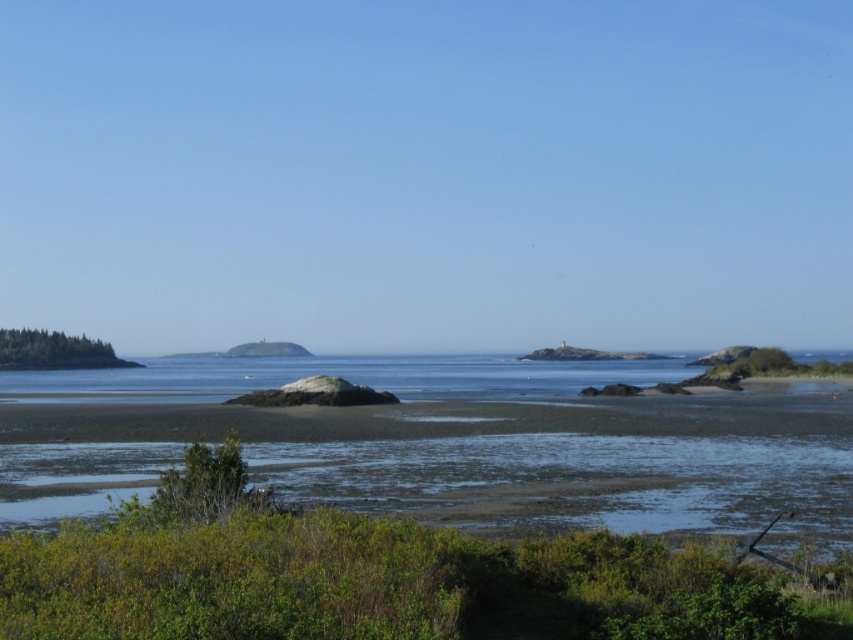
Is green grassy beach at lower center closer to the viewer compared to green grassy island at left?

Yes, it is in front of green grassy island at left.

Between point (370, 432) and point (42, 344), which one is positioned behind?

The point (42, 344) is behind.

Locate an element on the screen. green grassy beach at lower center is located at coordinates (x=457, y=452).

Is green grassy beach at lower center taller than clear blue water at center?

Yes, green grassy beach at lower center is taller than clear blue water at center.

This screenshot has height=640, width=853. What do you see at coordinates (457, 452) in the screenshot?
I see `green grassy beach at lower center` at bounding box center [457, 452].

Identify the location of green grassy beach at lower center. (457, 452).

Find the location of a particular element. The width and height of the screenshot is (853, 640). clear blue water at center is located at coordinates (347, 376).

Which is above, clear blue water at center or green grassy island at left?

green grassy island at left is above.

Locate an element on the screen. Image resolution: width=853 pixels, height=640 pixels. clear blue water at center is located at coordinates (347, 376).